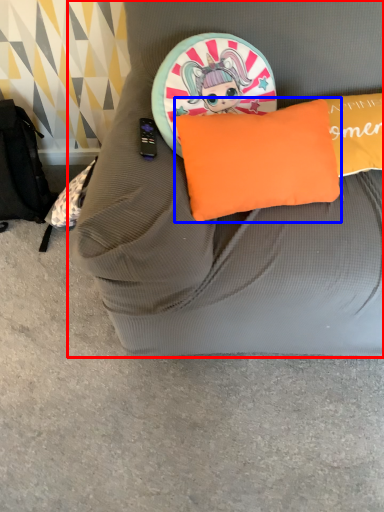
Question: Which of the following is the closest to the observer, furniture (highlighted by a red box) or pillow (highlighted by a blue box)?

Choices:
 (A) furniture
 (B) pillow

Answer: (A)